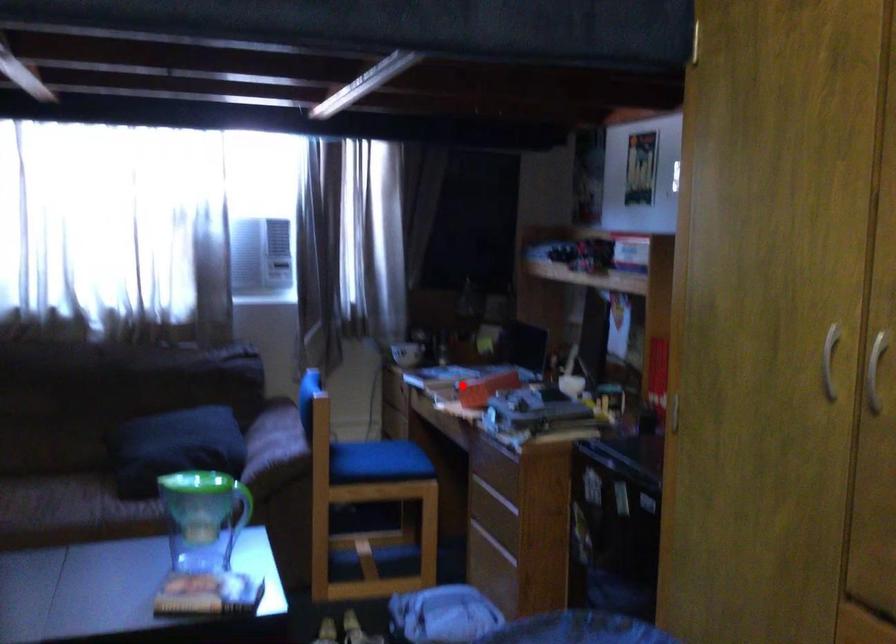
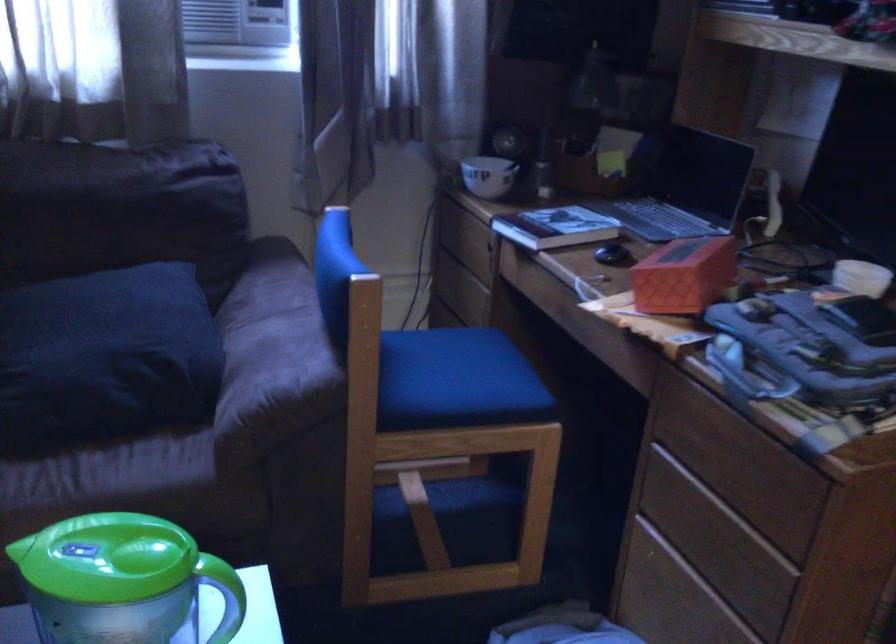
Locate, in the second image, the point that corresponds to the highlighted location in the first image.

(612, 254)